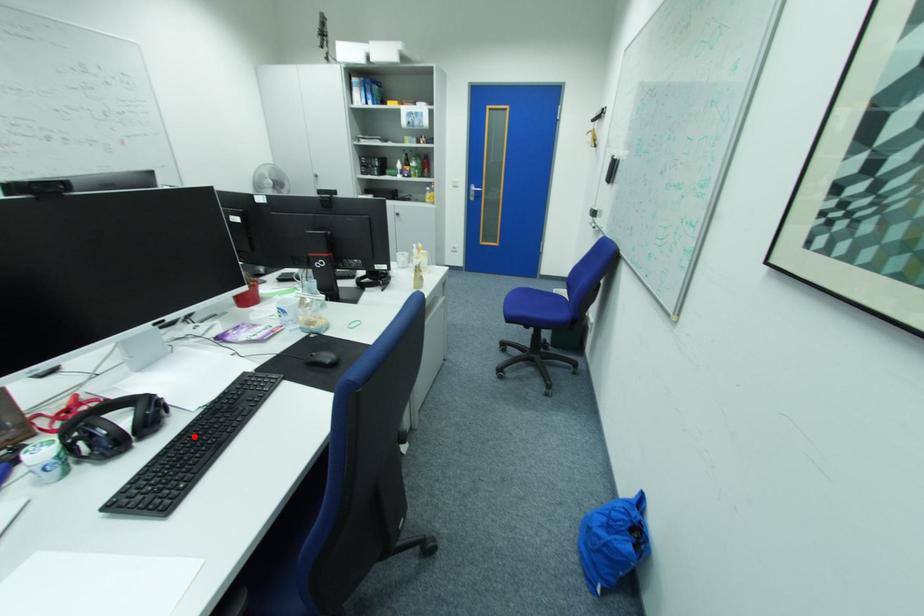
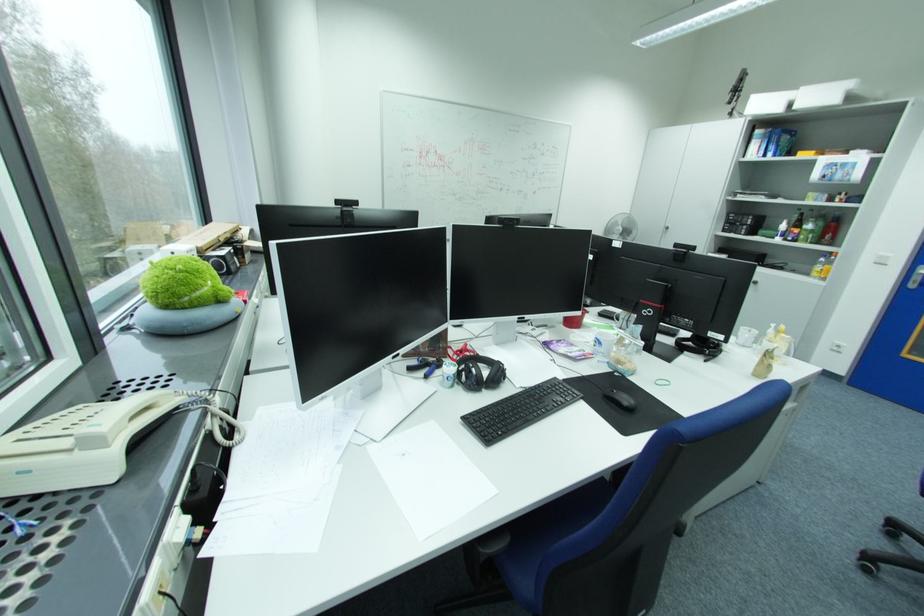
In the second image, find the point that corresponds to the highlighted location in the first image.

(518, 402)